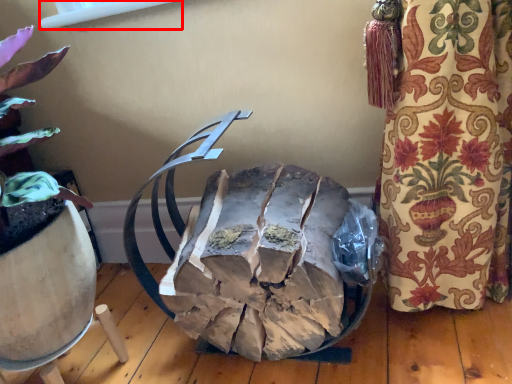
Question: In this image, where is window screen (annotated by the red box) located relative to waste?

Choices:
 (A) left
 (B) right

Answer: (A)